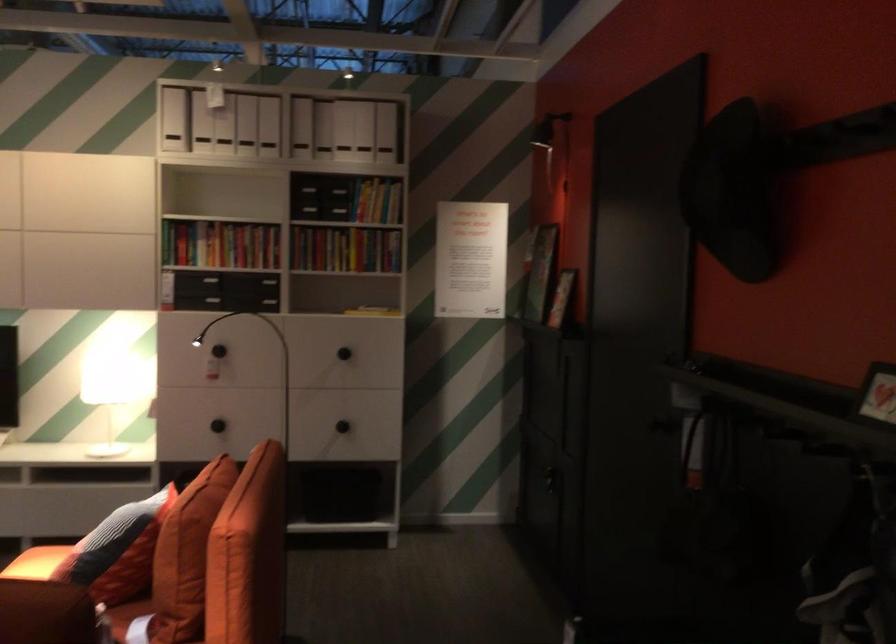
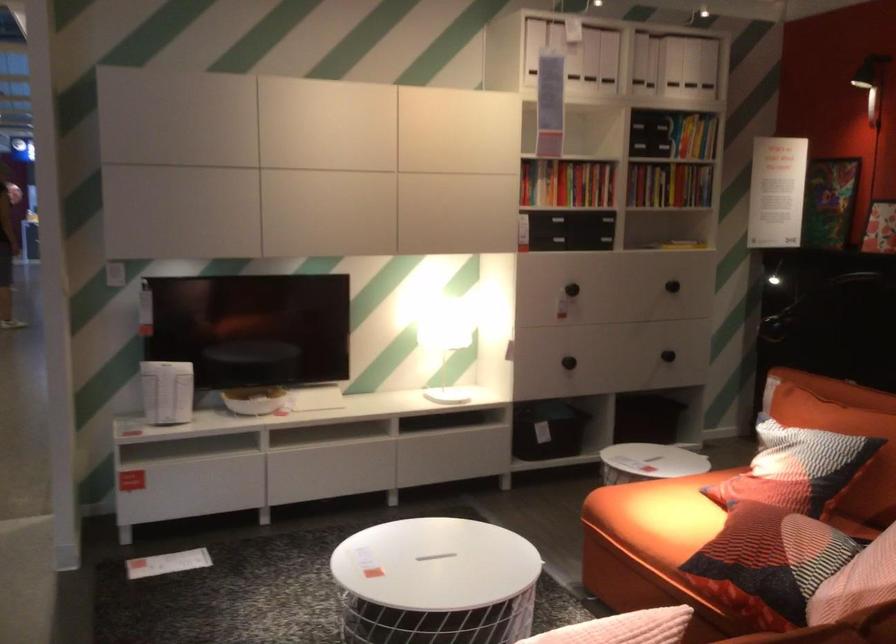
Question: In a continuous first-person perspective shot, in which direction is the camera moving?

Choices:
 (A) Left
 (B) Right
 (C) Forward
 (D) Backward

Answer: (A)